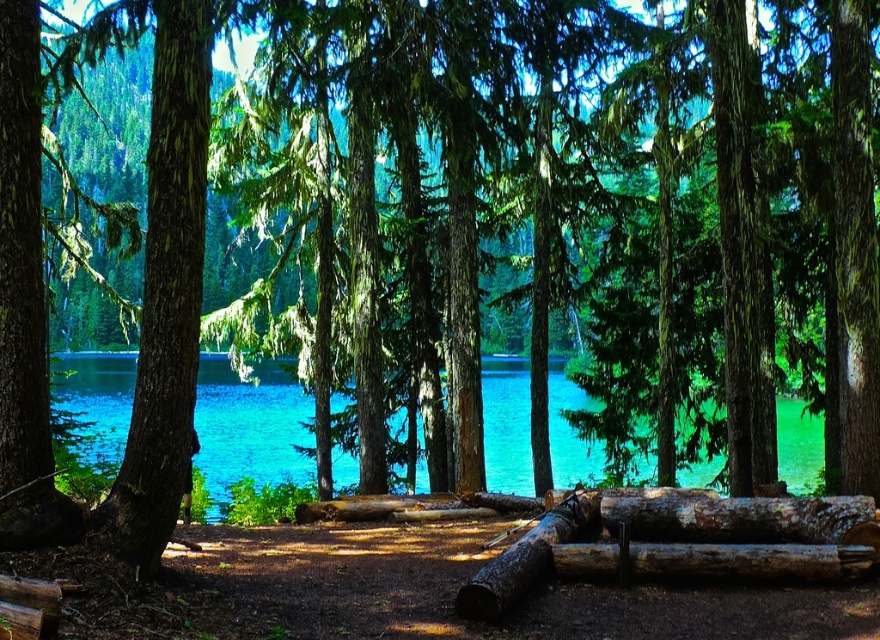
Who is more distant from viewer, (x=508, y=433) or (x=853, y=540)?

The point (x=508, y=433) is more distant.

Which is above, turquoise water at center or weathered brown log at center?

weathered brown log at center is above.

Is point (122, 422) positioned before point (860, 496)?

No, (122, 422) is behind (860, 496).

Where is `turquoise water at center`? The width and height of the screenshot is (880, 640). turquoise water at center is located at coordinates (250, 426).

Between rusty wood log at center and brown rough log at center, which one appears on the left side from the viewer's perspective?

From the viewer's perspective, rusty wood log at center appears more on the left side.

Does point (719, 540) lie in front of point (778, 545)?

No, (719, 540) is further to viewer.

Who is more distant from viewer, (871,531) or (759,554)?

The point (871,531) is more distant.

Locate an element on the screen. This screenshot has height=640, width=880. rusty wood log at center is located at coordinates (682, 544).

Does turquoise water at center appear over rusty wood log at center?

Incorrect, turquoise water at center is not positioned above rusty wood log at center.

Based on the photo, can you confirm if turquoise water at center is positioned to the left of rusty wood log at center?

Yes, turquoise water at center is to the left of rusty wood log at center.

Locate an element on the screen. turquoise water at center is located at coordinates (250, 426).